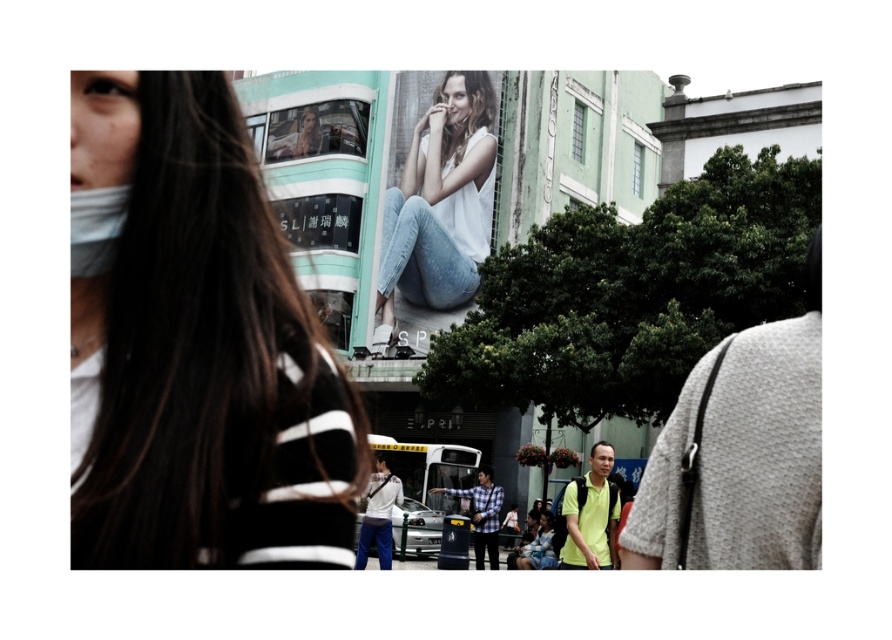
Is white matte face mask at left wider than white matte tank top at center?

No.

In the scene shown: Who is more forward, (352, 408) or (434, 301)?

Point (352, 408)

What do you see at coordinates (197, 349) in the screenshot? I see `white matte face mask at left` at bounding box center [197, 349].

At what (x,y) coordinates should I click in order to perform the action: click on white matte face mask at left. Please return your answer as a coordinate pair (x, y). Looking at the image, I should click on (197, 349).

Can you confirm if white matte tank top at center is smaller than white matte mask at left?

No.

Is white matte tank top at center to the right of white matte mask at left from the viewer's perspective?

Yes, white matte tank top at center is to the right of white matte mask at left.

Between point (414, 170) and point (78, 269), which one is positioned in front?

Point (78, 269) is in front.

You are a GUI agent. You are given a task and a screenshot of the screen. Output one action in this format:
    pyautogui.click(x=<x>, y=<y>)
    Task: Click on the white matte tank top at center
    Image resolution: width=892 pixels, height=640 pixels.
    Given the screenshot: What is the action you would take?
    pyautogui.click(x=439, y=204)

Can you confirm if white matte face mask at left is positioned above white matte mask at left?

Correct, white matte face mask at left is located above white matte mask at left.

Which is more to the left, white matte face mask at left or white matte mask at left?

Positioned to the left is white matte mask at left.

The height and width of the screenshot is (640, 892). I want to click on white matte face mask at left, so click(x=197, y=349).

Locate an element on the screen. This screenshot has width=892, height=640. white matte face mask at left is located at coordinates (197, 349).